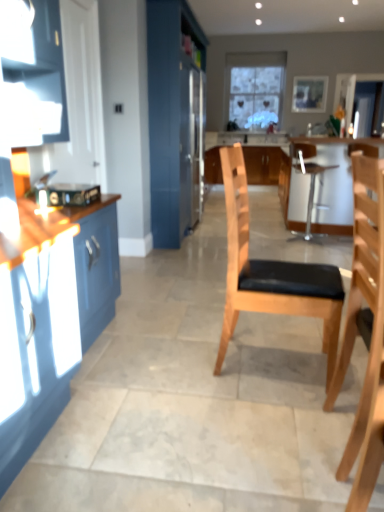
The image size is (384, 512). Identify the location of free space in front of light wood/black cushioned chair at center, the 3th chair from the right. (268, 413).